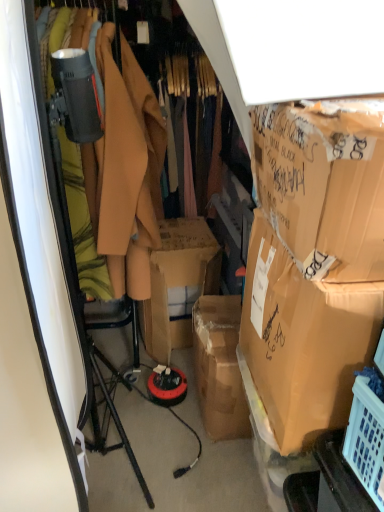
Find the location of a particular element. brown cardboard box at right, acting as the second box starting from the bottom is located at coordinates (324, 185).

From a real-world perspective, is brown cardboard box at right, which is counted as the second box, starting from the top, physically located above or below brown cardboard box at right, placed as the first box when sorted from top to bottom?

brown cardboard box at right, which is counted as the second box, starting from the top, is situated lower than brown cardboard box at right, placed as the first box when sorted from top to bottom, in the real world.

Is brown cardboard box at right, which is counted as the second box, starting from the top, inside the boundaries of brown cardboard box at right, placed as the first box when sorted from top to bottom, or outside?

brown cardboard box at right, which is counted as the second box, starting from the top, exists outside the volume of brown cardboard box at right, placed as the first box when sorted from top to bottom.

Could you measure the distance between brown cardboard box at right, the first box positioned from the bottom, and brown cardboard box at right, acting as the second box starting from the bottom?

They are 8.23 inches apart.

Based on the photo, is brown cardboard box at right, the first box positioned from the bottom, oriented away from brown cardboard box at right, acting as the second box starting from the bottom?

That's not correct — brown cardboard box at right, the first box positioned from the bottom, is not looking away from brown cardboard box at right, acting as the second box starting from the bottom.

How different are the orientations of brown cardboard box at right, acting as the second box starting from the bottom, and matte brown coat at center in degrees?

94.1 degrees separate the facing orientations of brown cardboard box at right, acting as the second box starting from the bottom, and matte brown coat at center.

Which is behind, point (290, 154) or point (135, 63)?

The point (135, 63) is more distant.

Is brown cardboard box at right, acting as the second box starting from the bottom, not inside matte brown coat at center?

That's correct, brown cardboard box at right, acting as the second box starting from the bottom, is outside of matte brown coat at center.

Are brown cardboard box at right, acting as the second box starting from the bottom, and matte brown coat at center far apart?

No, there isn't a large distance between brown cardboard box at right, acting as the second box starting from the bottom, and matte brown coat at center.

Does matte brown coat at center have a lesser width compared to brown cardboard box at right, placed as the first box when sorted from top to bottom?

In fact, matte brown coat at center might be wider than brown cardboard box at right, placed as the first box when sorted from top to bottom.

In the scene shown: What's the angular difference between matte brown coat at center and brown cardboard box at right, placed as the first box when sorted from top to bottom,'s facing directions?

94.1 degrees separate the facing orientations of matte brown coat at center and brown cardboard box at right, placed as the first box when sorted from top to bottom.

Which point is more distant from viewer, (x=157, y=208) or (x=292, y=142)?

Point (x=157, y=208)

Between matte brown coat at center and brown cardboard box at right, acting as the second box starting from the bottom, which one is positioned behind?

matte brown coat at center is further from the camera.

In the scene shown: Between matte brown coat at center and brown cardboard box at right, which is counted as the second box, starting from the top, which one has smaller width?

matte brown coat at center.

From a real-world perspective, is matte brown coat at center located beneath brown cardboard box at right, the first box positioned from the bottom?

No, from a real-world perspective, matte brown coat at center is not beneath brown cardboard box at right, the first box positioned from the bottom.

Who is shorter, matte brown coat at center or brown cardboard box at right, which is counted as the second box, starting from the top?

With less height is brown cardboard box at right, which is counted as the second box, starting from the top.

Is matte brown coat at center positioned with its back to brown cardboard box at right, the first box positioned from the bottom?

No, brown cardboard box at right, the first box positioned from the bottom, is not at the back of matte brown coat at center.

Could you measure the distance between brown cardboard box at right, placed as the first box when sorted from top to bottom, and brown cardboard box at right, the first box positioned from the bottom?

8.23 inches.

Consider the image. Is brown cardboard box at right, placed as the first box when sorted from top to bottom, facing towards brown cardboard box at right, the first box positioned from the bottom?

No, brown cardboard box at right, placed as the first box when sorted from top to bottom, is not facing towards brown cardboard box at right, the first box positioned from the bottom.

Do you think brown cardboard box at right, placed as the first box when sorted from top to bottom, is within brown cardboard box at right, which is counted as the second box, starting from the top, or outside of it?

brown cardboard box at right, placed as the first box when sorted from top to bottom, is outside brown cardboard box at right, which is counted as the second box, starting from the top.

Who is smaller, brown cardboard box at right, acting as the second box starting from the bottom, or brown cardboard box at right, the first box positioned from the bottom?

With smaller size is brown cardboard box at right, acting as the second box starting from the bottom.

Find the location of a particular element. Image resolution: width=384 pixels, height=512 pixels. box that appears below the matte brown coat at center (from a real-world perspective) is located at coordinates (303, 340).

Can you tell me how much brown cardboard box at right, the first box positioned from the bottom, and matte brown coat at center differ in facing direction?

94.1 degrees.

In the scene shown: From the image's perspective, does brown cardboard box at right, the first box positioned from the bottom, appear lower than matte brown coat at center?

Yes.

Considering the relative positions of brown cardboard box at right, the first box positioned from the bottom, and matte brown coat at center in the image provided, is brown cardboard box at right, the first box positioned from the bottom, behind matte brown coat at center?

That is False.

Locate an element on the screen. box behind the brown cardboard box at right, placed as the first box when sorted from top to bottom is located at coordinates (303, 340).

Where is `the 2nd box in front of the matte brown coat at center`? The width and height of the screenshot is (384, 512). the 2nd box in front of the matte brown coat at center is located at coordinates (324, 185).

Which object lies nearer to the anchor point brown cardboard box at right, the first box positioned from the bottom, brown cardboard box at right, acting as the second box starting from the bottom, or matte brown coat at center?

brown cardboard box at right, acting as the second box starting from the bottom, is positioned closer to the anchor brown cardboard box at right, the first box positioned from the bottom.

Based on their spatial positions, is matte brown coat at center or brown cardboard box at right, the first box positioned from the bottom, closer to brown cardboard box at right, placed as the first box when sorted from top to bottom?

Among the two, brown cardboard box at right, the first box positioned from the bottom, is located nearer to brown cardboard box at right, placed as the first box when sorted from top to bottom.

Considering their positions, is brown cardboard box at right, acting as the second box starting from the bottom, positioned further to matte brown coat at center than brown cardboard box at right, the first box positioned from the bottom?

brown cardboard box at right, acting as the second box starting from the bottom.

Considering their positions, is brown cardboard box at right, which is counted as the second box, starting from the top, positioned closer to brown cardboard box at right, placed as the first box when sorted from top to bottom, than matte brown coat at center?

brown cardboard box at right, which is counted as the second box, starting from the top, is positioned closer to the anchor brown cardboard box at right, placed as the first box when sorted from top to bottom.

Which object lies further to the anchor point matte brown coat at center, brown cardboard box at right, the first box positioned from the bottom, or brown cardboard box at right, placed as the first box when sorted from top to bottom?

brown cardboard box at right, placed as the first box when sorted from top to bottom.

Estimate the real-world distances between objects in this image. Which object is further from brown cardboard box at right, the first box positioned from the bottom, matte brown coat at center or brown cardboard box at right, placed as the first box when sorted from top to bottom?

The object further to brown cardboard box at right, the first box positioned from the bottom, is matte brown coat at center.

Locate an element on the screen. This screenshot has height=512, width=384. box positioned between brown cardboard box at right, acting as the second box starting from the bottom, and matte brown coat at center from near to far is located at coordinates (303, 340).